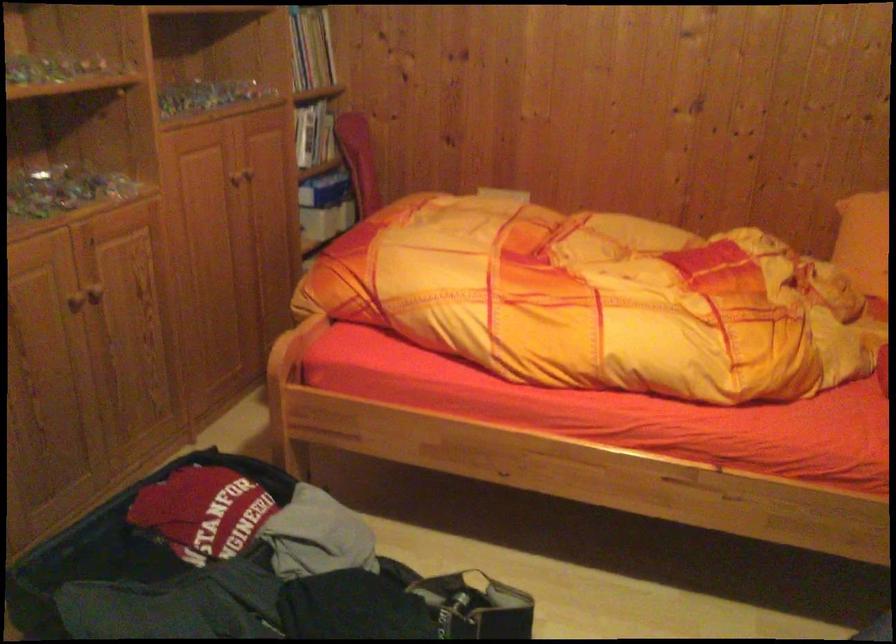
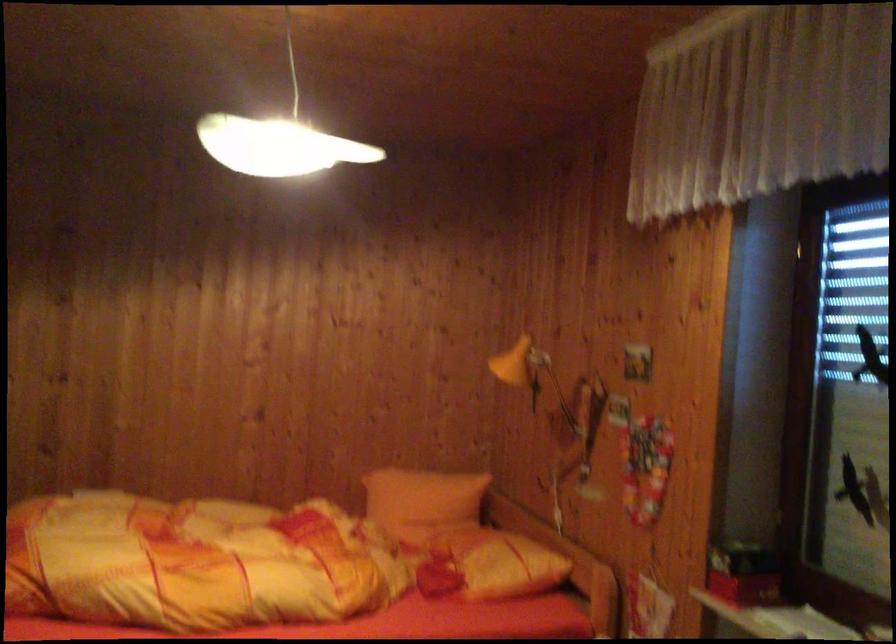
First-person continuous shooting, in which direction is the camera rotating?

The camera rotated toward right-up.